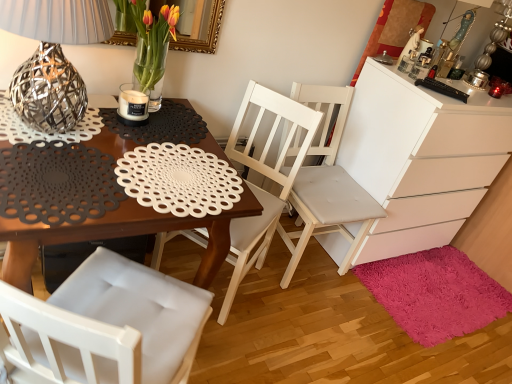
The image size is (512, 384). I want to click on free location to the right of matte glass vase with tulips at upper center, so click(x=179, y=118).